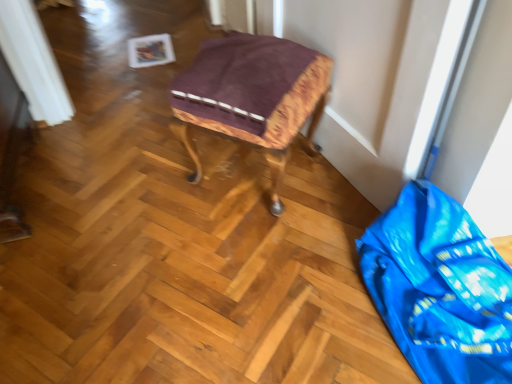
Question: Does point (322, 109) appear closer or farther from the camera than point (376, 291)?

Choices:
 (A) closer
 (B) farther

Answer: (B)

Question: Is wooden stool at center wider or thinner than blue shiny plastic bag at lower right?

Choices:
 (A) wide
 (B) thin

Answer: (B)

Question: Relative to blue shiny plastic bag at lower right, is wooden stool at center in front or behind?

Choices:
 (A) front
 (B) behind

Answer: (B)

Question: Considering the positions of blue shiny plastic bag at lower right and wooden stool at center in the image, is blue shiny plastic bag at lower right wider or thinner than wooden stool at center?

Choices:
 (A) wide
 (B) thin

Answer: (A)

Question: Is point (410, 228) closer or farther from the camera than point (259, 57)?

Choices:
 (A) farther
 (B) closer

Answer: (B)

Question: Is blue shiny plastic bag at lower right situated inside wooden stool at center or outside?

Choices:
 (A) outside
 (B) inside

Answer: (A)

Question: From a real-world perspective, is blue shiny plastic bag at lower right positioned above or below wooden stool at center?

Choices:
 (A) above
 (B) below

Answer: (B)